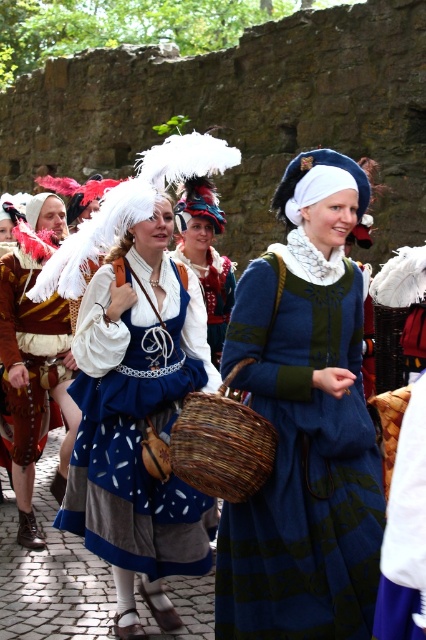
Question: Is matte blue dress at center positioned at the back of woven brown basket at center?

Choices:
 (A) no
 (B) yes

Answer: (B)

Question: Which of the following is the closest to the observer?

Choices:
 (A) blue velvet dress at center
 (B) matte white dress at center
 (C) matte blue dress at center
 (D) woven brown basket at center

Answer: (A)

Question: Is blue velvet dress at center to the right of matte white dress at center from the viewer's perspective?

Choices:
 (A) no
 (B) yes

Answer: (B)

Question: Among these points, which one is nearest to the camera?

Choices:
 (A) (34, 404)
 (B) (80, 488)

Answer: (B)

Question: Which point appears farthest from the camera in this image?

Choices:
 (A) (193, 378)
 (B) (265, 465)

Answer: (A)

Question: Is the position of blue velvet dress at center less distant than that of woven brown basket at center?

Choices:
 (A) yes
 (B) no

Answer: (A)